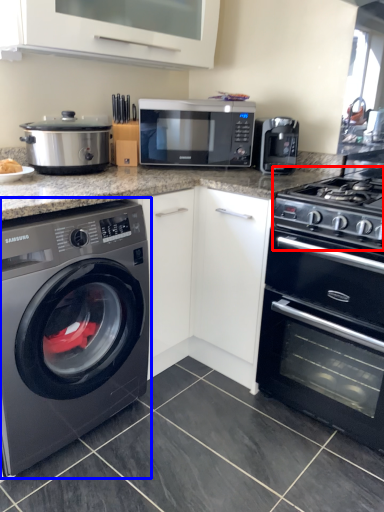
Question: Among these objects, which one is nearest to the camera, gas stove (highlighted by a red box) or washing machine (highlighted by a blue box)?

Choices:
 (A) gas stove
 (B) washing machine

Answer: (B)